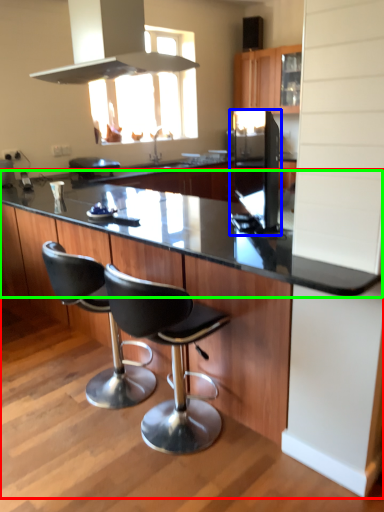
Question: Considering the real-world distances, which object is farthest from countertop (highlighted by a red box)? appliance (highlighted by a blue box) or countertop (highlighted by a green box)?

Choices:
 (A) appliance
 (B) countertop

Answer: (A)